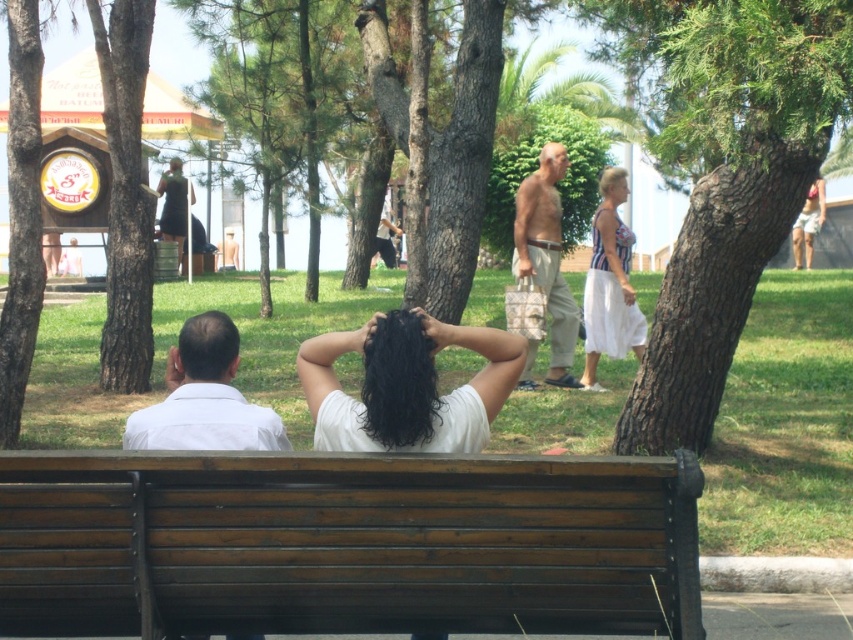
Question: Is brown rough bark tree at right to the left of tan canvas bag at center from the viewer's perspective?

Choices:
 (A) yes
 (B) no

Answer: (B)

Question: Can you confirm if brown rough bark tree at right is bigger than tan canvas bag at center?

Choices:
 (A) yes
 (B) no

Answer: (A)

Question: Can you confirm if brown wooden bench at center is positioned below white cotton dress at center?

Choices:
 (A) yes
 (B) no

Answer: (A)

Question: Which point is closer to the camera taking this photo?

Choices:
 (A) coord(567,589)
 (B) coord(492,360)
 (C) coord(778,202)
 (D) coord(263,429)

Answer: (A)

Question: Among these objects, which one is nearest to the camera?

Choices:
 (A) brown wood tree at center
 (B) brown rough bark tree at right
 (C) brown wooden bench at center

Answer: (C)

Question: Which object is farther from the camera taking this photo?

Choices:
 (A) brown rough bark tree at right
 (B) white matte shirt at center
 (C) white matte shirt at left

Answer: (A)